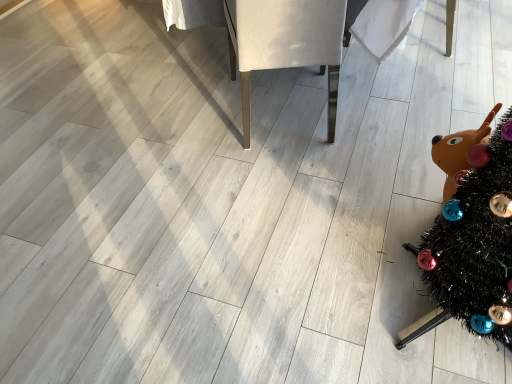
Measure the distance between black tinsel christmas tree at lower right and camera.

A distance of 95.37 centimeters exists between black tinsel christmas tree at lower right and camera.

Describe the element at coordinates (473, 242) in the screenshot. The width and height of the screenshot is (512, 384). I see `black tinsel christmas tree at lower right` at that location.

Locate an element on the screen. black tinsel christmas tree at lower right is located at coordinates (473, 242).

Where is `white fabric chair at center`? Image resolution: width=512 pixels, height=384 pixels. white fabric chair at center is located at coordinates (285, 43).

What is the approximate width of white fabric chair at center?

It is 24.68 inches.

Describe the element at coordinates (285, 43) in the screenshot. I see `white fabric chair at center` at that location.

What is the approximate height of white fabric chair at center?

white fabric chair at center is 25.84 inches tall.

Identify the location of black tinsel christmas tree at lower right. The width and height of the screenshot is (512, 384). (473, 242).

Which object is positioned more to the left, black tinsel christmas tree at lower right or white fabric chair at center?

white fabric chair at center is more to the left.

Is black tinsel christmas tree at lower right in front of or behind white fabric chair at center in the image?

Visually, black tinsel christmas tree at lower right is located in front of white fabric chair at center.

Which is in front, point (444, 260) or point (282, 19)?

Positioned in front is point (444, 260).

From the image's perspective, between black tinsel christmas tree at lower right and white fabric chair at center, which one is located above?

white fabric chair at center appears higher in the image.

From a real-world perspective, which is physically above, black tinsel christmas tree at lower right or white fabric chair at center?

black tinsel christmas tree at lower right is physically above.

In terms of width, does black tinsel christmas tree at lower right look wider or thinner when compared to white fabric chair at center?

In the image, black tinsel christmas tree at lower right appears to be more narrow than white fabric chair at center.

Between black tinsel christmas tree at lower right and white fabric chair at center, which one has less height?

With less height is white fabric chair at center.

Which of these two, black tinsel christmas tree at lower right or white fabric chair at center, is smaller?

Smaller between the two is black tinsel christmas tree at lower right.

Consider the image. Is black tinsel christmas tree at lower right located outside white fabric chair at center?

black tinsel christmas tree at lower right lies outside white fabric chair at center's area.

Is black tinsel christmas tree at lower right positioned far away from white fabric chair at center?

No, there isn't a large distance between black tinsel christmas tree at lower right and white fabric chair at center.

Could you tell me if black tinsel christmas tree at lower right is turned towards white fabric chair at center?

No, black tinsel christmas tree at lower right is not turned towards white fabric chair at center.

How many degrees apart are the facing directions of black tinsel christmas tree at lower right and white fabric chair at center?

The angle between the facing direction of black tinsel christmas tree at lower right and the facing direction of white fabric chair at center is 65.5 degrees.

Image resolution: width=512 pixels, height=384 pixels. Identify the location of furniture that appears on the left of black tinsel christmas tree at lower right. (285, 43).

From the picture: Is white fabric chair at center to the left or to the right of black tinsel christmas tree at lower right in the image?

Based on their positions, white fabric chair at center is located to the left of black tinsel christmas tree at lower right.

Relative to black tinsel christmas tree at lower right, is white fabric chair at center in front or behind?

white fabric chair at center is behind black tinsel christmas tree at lower right.

Does point (333, 111) lie in front of point (500, 250)?

That is False.

From the image's perspective, relative to black tinsel christmas tree at lower right, is white fabric chair at center above or below?

From the image's perspective, white fabric chair at center appears above black tinsel christmas tree at lower right.

From a real-world perspective, is white fabric chair at center physically located above or below black tinsel christmas tree at lower right?

white fabric chair at center is situated lower than black tinsel christmas tree at lower right in the real world.

Which object is wider, white fabric chair at center or black tinsel christmas tree at lower right?

With larger width is white fabric chair at center.

Is white fabric chair at center taller or shorter than black tinsel christmas tree at lower right?

Considering their sizes, white fabric chair at center has less height than black tinsel christmas tree at lower right.

Does white fabric chair at center have a larger size compared to black tinsel christmas tree at lower right?

Correct, white fabric chair at center is larger in size than black tinsel christmas tree at lower right.

Is white fabric chair at center completely or partially outside of black tinsel christmas tree at lower right?

white fabric chair at center is positioned outside black tinsel christmas tree at lower right.

Is white fabric chair at center placed right next to black tinsel christmas tree at lower right?

They are not placed beside each other.

Looking at this image, could you tell me if white fabric chair at center is turned towards black tinsel christmas tree at lower right?

No.

How different are the orientations of white fabric chair at center and black tinsel christmas tree at lower right in degrees?

white fabric chair at center and black tinsel christmas tree at lower right are facing 65.5 degrees away from each other.

The height and width of the screenshot is (384, 512). Identify the location of christmas tree above the white fabric chair at center (from a real-world perspective). (473, 242).

This screenshot has width=512, height=384. I want to click on christmas tree in front of the white fabric chair at center, so click(473, 242).

You are a GUI agent. You are given a task and a screenshot of the screen. Output one action in this format:
    pyautogui.click(x=<x>, y=<y>)
    Task: Click on the furniture above the black tinsel christmas tree at lower right (from the image's perspective)
    Image resolution: width=512 pixels, height=384 pixels.
    Given the screenshot: What is the action you would take?
    pyautogui.click(x=285, y=43)